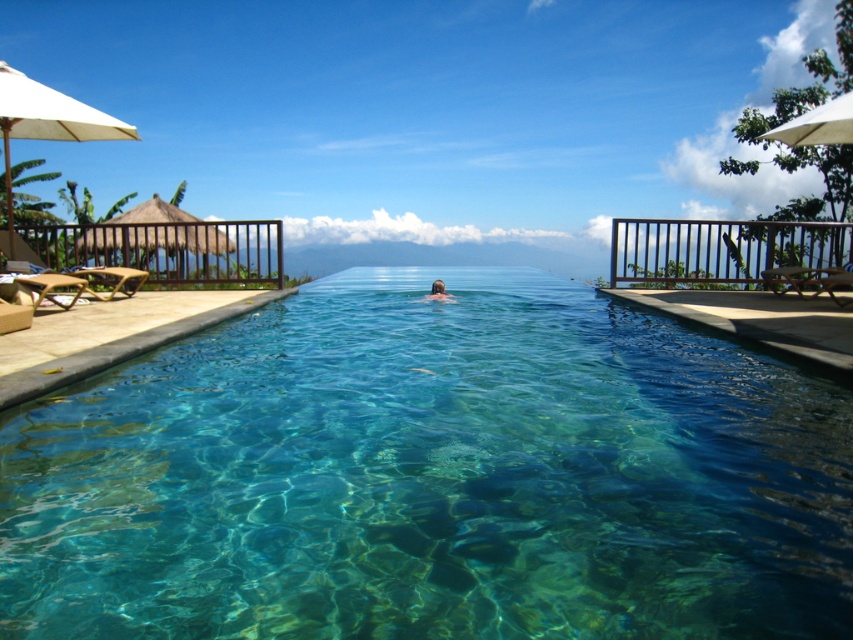
Question: Can you confirm if white fabric umbrella at left is positioned to the left of white fabric umbrella at upper right?

Choices:
 (A) no
 (B) yes

Answer: (B)

Question: Can you confirm if white fabric umbrella at left is smaller than brown hair at center?

Choices:
 (A) no
 (B) yes

Answer: (A)

Question: Which of the following is the farthest from the observer?

Choices:
 (A) (807, 129)
 (B) (111, 129)
 (C) (67, 467)
 (D) (437, 289)

Answer: (D)

Question: Which point is farther to the camera?

Choices:
 (A) brown hair at center
 (B) white fabric umbrella at left
 (C) clear glass pool at center

Answer: (A)

Question: Which point is closer to the camera taking this photo?

Choices:
 (A) (10, 257)
 (B) (843, 140)

Answer: (B)

Question: Is clear glass pool at center to the right of white fabric umbrella at left from the viewer's perspective?

Choices:
 (A) yes
 (B) no

Answer: (A)